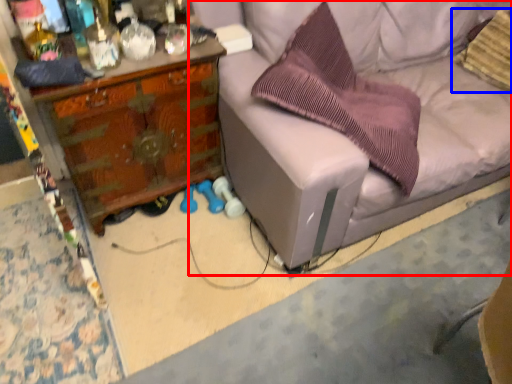
Question: Which object is closer to the camera taking this photo, studio couch (highlighted by a red box) or pillow (highlighted by a blue box)?

Choices:
 (A) studio couch
 (B) pillow

Answer: (A)